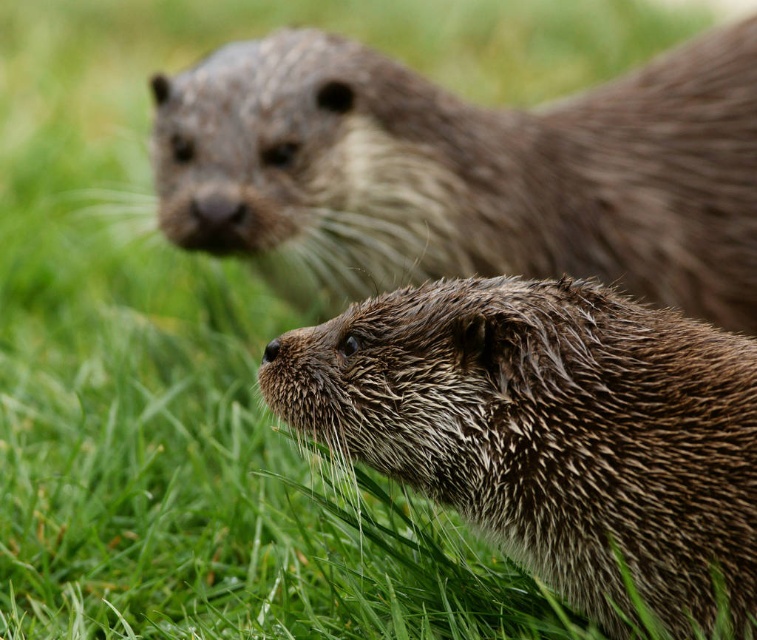
Between brown fuzzy otter at upper center and wet fur otter at center, which one is positioned lower?

wet fur otter at center is lower down.

Is point (204, 81) behind point (743, 547)?

Yes.

Measure the distance between brown fuzzy otter at upper center and camera.

brown fuzzy otter at upper center and camera are 3.09 meters apart.

This screenshot has height=640, width=757. Identify the location of brown fuzzy otter at upper center. (463, 173).